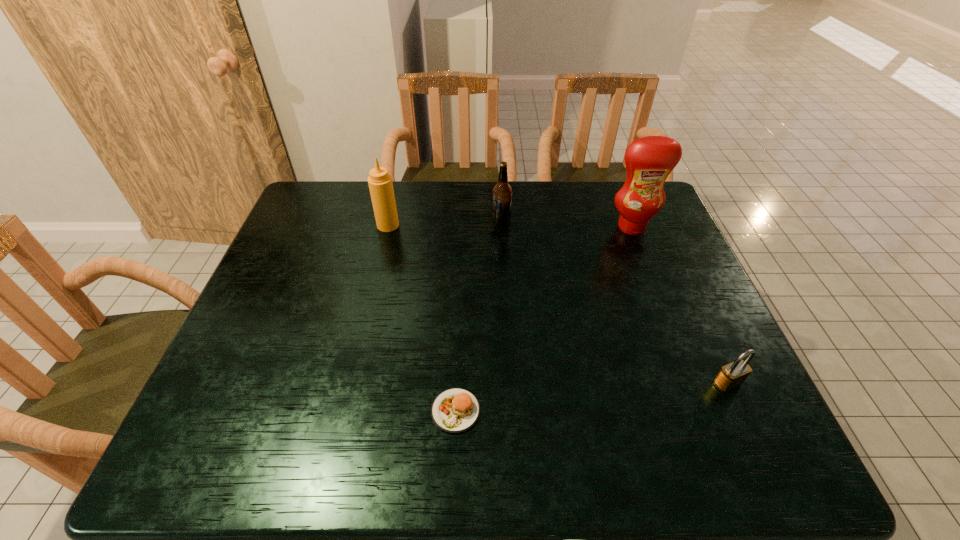
Find the location of `vacant space situated 0.210m on the label of the third object from right to left`. vacant space situated 0.210m on the label of the third object from right to left is located at coordinates (424, 225).

Locate an element on the screen. Image resolution: width=960 pixels, height=540 pixels. vacant area situated 0.110m on the label of the third object from right to left is located at coordinates (457, 225).

Where is `free location located on the label of the third object from right to left`? This screenshot has height=540, width=960. free location located on the label of the third object from right to left is located at coordinates (373, 225).

Identify the location of free space located 0.110m on the back of the padlock. (705, 334).

Locate an element on the screen. The width and height of the screenshot is (960, 540). blank space located 0.170m on the back of the shortest object is located at coordinates click(x=459, y=328).

Locate an element on the screen. The image size is (960, 540). beer bottle that is at the far edge is located at coordinates [x=502, y=192].

Identify the location of object that is at the near edge. (455, 410).

You are a GUI agent. You are given a task and a screenshot of the screen. Output one action in this format:
    pyautogui.click(x=<x>, y=<y>)
    Task: Click on the condiment that is at the right edge
    Image resolution: width=960 pixels, height=540 pixels.
    Given the screenshot: What is the action you would take?
    pyautogui.click(x=649, y=160)

Where is `padlock present at the right edge`? This screenshot has width=960, height=540. padlock present at the right edge is located at coordinates (732, 375).

You are a GUI agent. You are given a task and a screenshot of the screen. Output one action in this format:
    pyautogui.click(x=<x>, y=<y>)
    Task: Click on the object that is at the far right corner
    Image resolution: width=960 pixels, height=540 pixels.
    Given the screenshot: What is the action you would take?
    pyautogui.click(x=649, y=160)